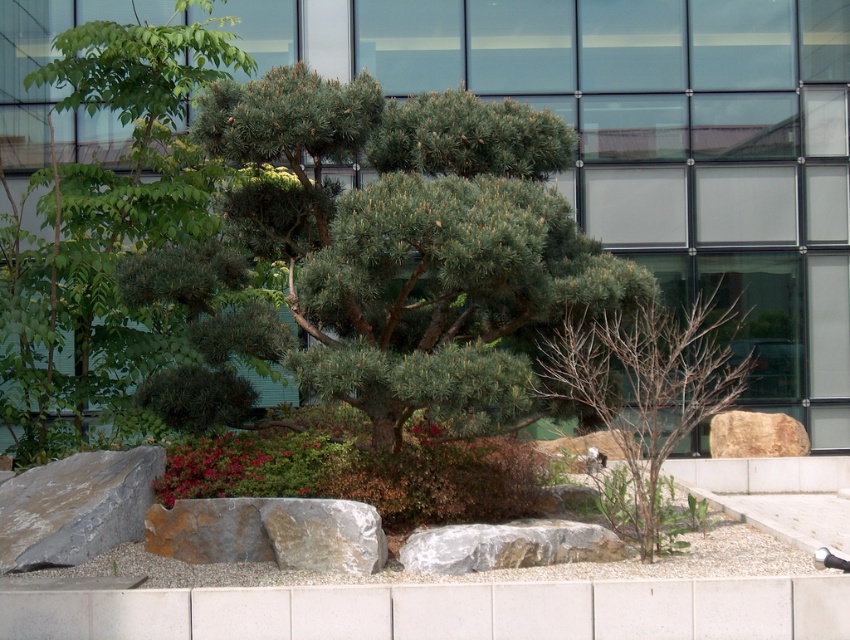
You are standing in the garden and want to place a small potted plant exactly at the point marked by the coordinates point (x=75, y=506). Based on the garden layout, what type of terrain or object will the potted plant be placed on?

The point (x=75, y=506) indicates a gray rough rock at lower left, so the potted plant will be placed on the gray rough rock at lower left.

You are a landscape architect reviewing the garden layout. You need to determine which tree occupies more space in the garden. Which tree is larger in size between the green leafy tree at upper left and the bare wood tree at center?

The green leafy tree at upper left is bigger than the bare wood tree at center, so it occupies more space in the garden.